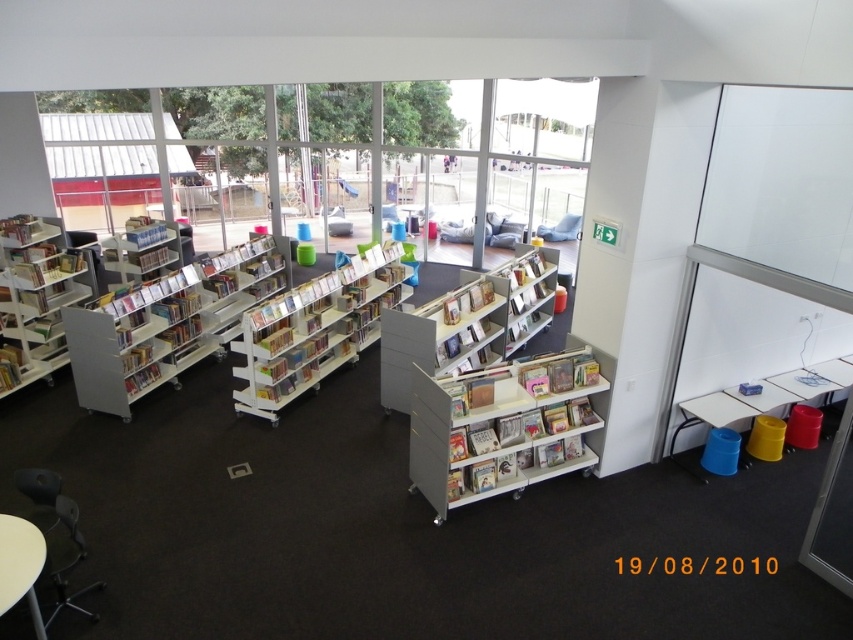
Is point (426, 362) positioned behind point (18, 316)?

No, it is in front of (18, 316).

Who is positioned more to the left, white plastic bookcase at center or white glossy bookshelf at left?

white glossy bookshelf at left

Is point (387, 348) positioned after point (90, 266)?

No, it is not.

The width and height of the screenshot is (853, 640). I want to click on white plastic bookcase at center, so tap(468, 323).

Is white plastic bookshelf at center closer to the viewer compared to matte plastic bookshelf at center?

Yes, white plastic bookshelf at center is in front of matte plastic bookshelf at center.

Is white plastic bookshelf at center above matte plastic bookshelf at center?

No, white plastic bookshelf at center is not above matte plastic bookshelf at center.

Which is in front, point (381, 259) or point (529, 276)?

Point (529, 276) is in front.

The height and width of the screenshot is (640, 853). What are the coordinates of `white plastic bookshelf at center` in the screenshot? It's located at (314, 330).

Image resolution: width=853 pixels, height=640 pixels. What do you see at coordinates (36, 298) in the screenshot?
I see `white glossy bookshelf at left` at bounding box center [36, 298].

Is white glossy bookshelf at left to the left of hardcover book at lower left from the viewer's perspective?

Correct, you'll find white glossy bookshelf at left to the left of hardcover book at lower left.

Is point (55, 280) farther from viewer compared to point (9, 371)?

Yes, point (55, 280) is farther from viewer.

At what (x,y) coordinates should I click in order to perform the action: click on white glossy bookshelf at left. Please return your answer as a coordinate pair (x, y). Looking at the image, I should click on (36, 298).